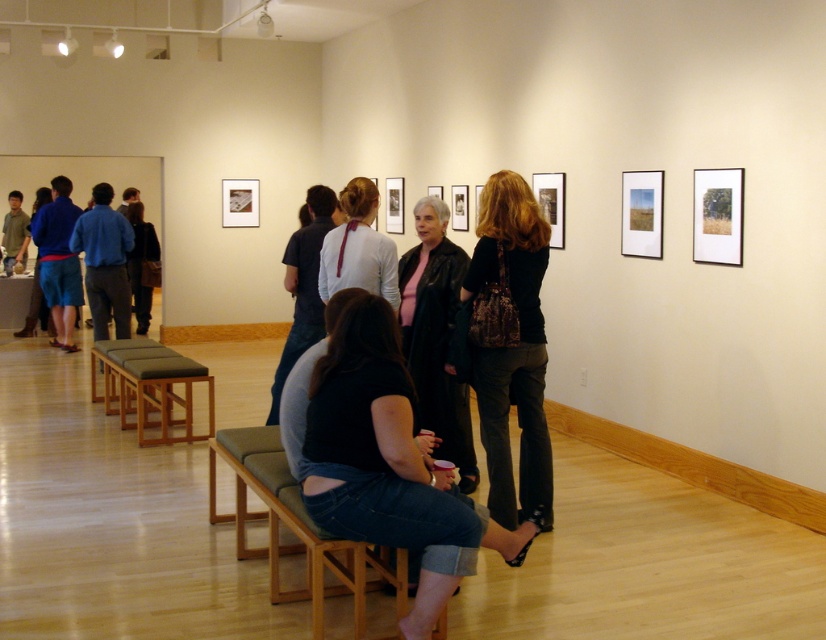
Can you confirm if light pink silky blouse at center is shorter than wooden bench at lower left?

Incorrect, light pink silky blouse at center's height does not fall short of wooden bench at lower left's.

The image size is (826, 640). In order to click on light pink silky blouse at center in this screenshot , I will do pyautogui.click(x=358, y=248).

This screenshot has width=826, height=640. Find the location of `light pink silky blouse at center`. light pink silky blouse at center is located at coordinates (358, 248).

The width and height of the screenshot is (826, 640). What are the coordinates of `light pink silky blouse at center` in the screenshot? It's located at (358, 248).

Is shiny black purse at center bigger than leather jacket at center?

Yes.

Between shiny black purse at center and leather jacket at center, which one is positioned lower?

shiny black purse at center is below.

Where is `shiny black purse at center`? The image size is (826, 640). shiny black purse at center is located at coordinates (508, 346).

Between wooden bench at lower left and matte blue shirt at center, which one has more height?

With more height is matte blue shirt at center.

Between wooden bench at lower left and matte blue shirt at center, which one is positioned lower?

wooden bench at lower left is below.

Identify the location of wooden bench at lower left. (162, 396).

Where is `wooden bench at lower left`? Image resolution: width=826 pixels, height=640 pixels. wooden bench at lower left is located at coordinates (162, 396).